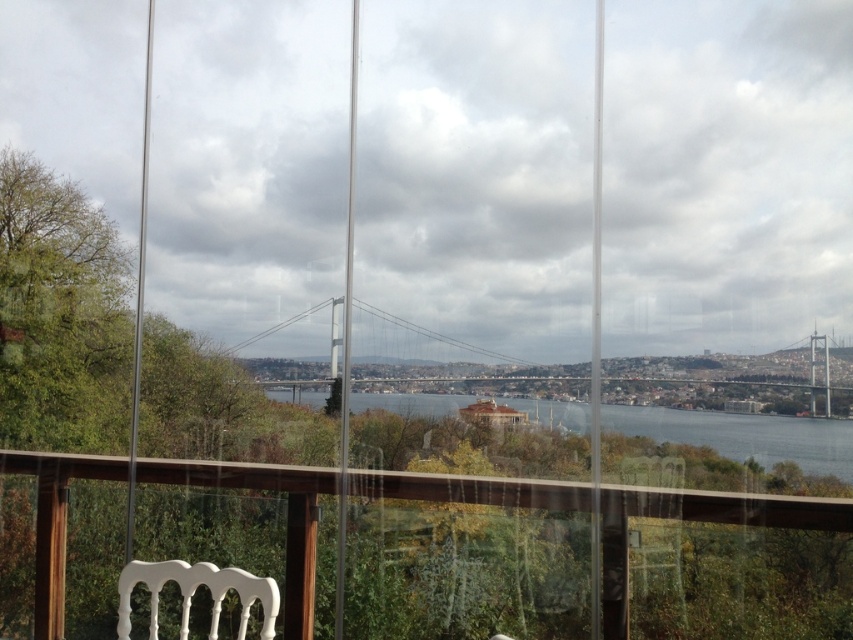
Question: Which object is farther from the camera taking this photo?

Choices:
 (A) white matte chair at lower left
 (B) transparent glass railing at center
 (C) blue water at center

Answer: (C)

Question: Is transparent glass railing at center to the left of white matte chair at lower left from the viewer's perspective?

Choices:
 (A) yes
 (B) no

Answer: (B)

Question: Considering the relative positions of transparent glass railing at center and blue water at center in the image provided, where is transparent glass railing at center located with respect to blue water at center?

Choices:
 (A) right
 (B) left

Answer: (B)

Question: Among these objects, which one is farthest from the camera?

Choices:
 (A) transparent glass railing at center
 (B) white plastic chair at lower center
 (C) blue water at center
 (D) white matte chair at lower left

Answer: (B)

Question: Which of these objects is positioned farthest from the blue water at center?

Choices:
 (A) white plastic chair at lower center
 (B) white matte chair at lower left
 (C) transparent glass railing at center

Answer: (B)

Question: Can you confirm if blue water at center is wider than white matte chair at lower left?

Choices:
 (A) yes
 (B) no

Answer: (A)